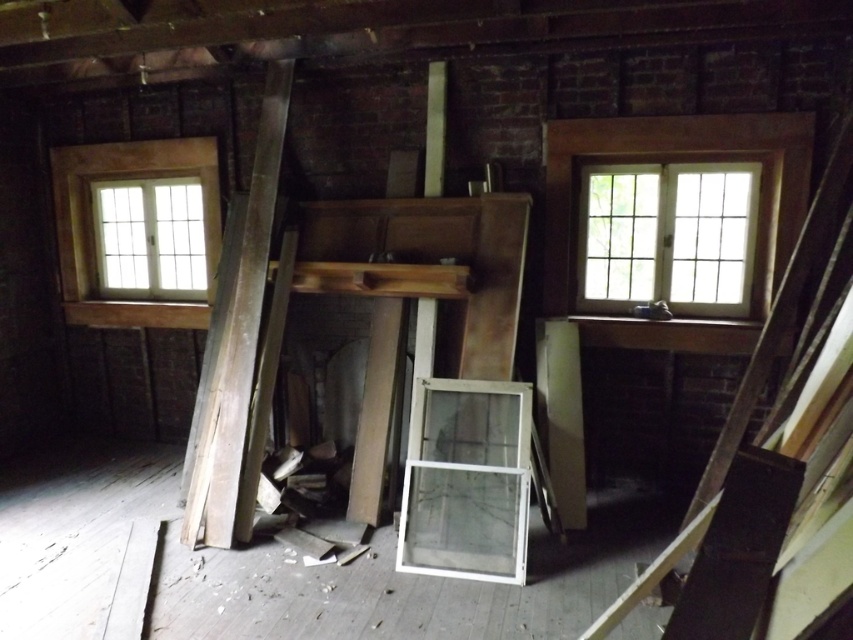
Question: Is the position of white glass door at center less distant than that of weathered wood beam at left?

Choices:
 (A) yes
 (B) no

Answer: (A)

Question: Which of the following is the closest to the observer?

Choices:
 (A) (175, 179)
 (B) (490, 476)

Answer: (B)

Question: Can you confirm if clear glass window at upper right is bigger than clear glass window at left?

Choices:
 (A) no
 (B) yes

Answer: (A)

Question: Can you confirm if white glass door at center is positioned to the right of weathered wood beam at left?

Choices:
 (A) no
 (B) yes

Answer: (B)

Question: Which of the following is the farthest from the observer?

Choices:
 (A) clear glass window at upper right
 (B) wooden at right
 (C) white glass door at center
 (D) weathered wood beam at left

Answer: (A)

Question: Which object appears closest to the camera in this image?

Choices:
 (A) wooden at right
 (B) clear glass window at upper right
 (C) weathered wood beam at left
 (D) white glass door at center

Answer: (A)